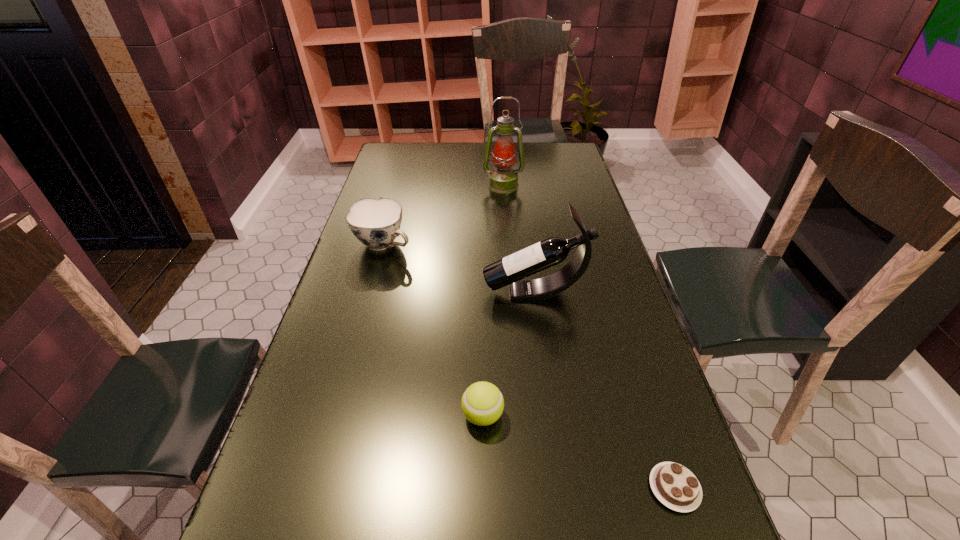
You are a GUI agent. You are given a task and a screenshot of the screen. Output one action in this format:
    pyautogui.click(x=<x>, y=<y>)
    Task: Click on the oil lamp
    Image resolution: width=960 pixels, height=540 pixels.
    Given the screenshot: What is the action you would take?
    pyautogui.click(x=503, y=179)

You are a GUI agent. You are given a task and a screenshot of the screen. Output one action in this format:
    pyautogui.click(x=<x>, y=<y>)
    Task: Click on the farthest object
    This screenshot has width=960, height=540.
    Given the screenshot: What is the action you would take?
    pyautogui.click(x=503, y=179)

Find the location of `the fourth shortest object`. the fourth shortest object is located at coordinates (509, 270).

Find the location of `the third nearest object`. the third nearest object is located at coordinates (509, 270).

Where is `the leftmost object`? The image size is (960, 540). the leftmost object is located at coordinates (376, 223).

The height and width of the screenshot is (540, 960). Find the location of `the fourth nearest object`. the fourth nearest object is located at coordinates (376, 223).

Where is `tennis ball`? tennis ball is located at coordinates (482, 403).

Locate an element on the screen. the second shortest object is located at coordinates (482, 403).

At what (x,y) coordinates should I click in order to perform the action: click on the shortest object. Please return your answer as a coordinate pair (x, y). The width and height of the screenshot is (960, 540). Looking at the image, I should click on (675, 486).

In order to click on chocolate cake in this screenshot , I will do `click(675, 486)`.